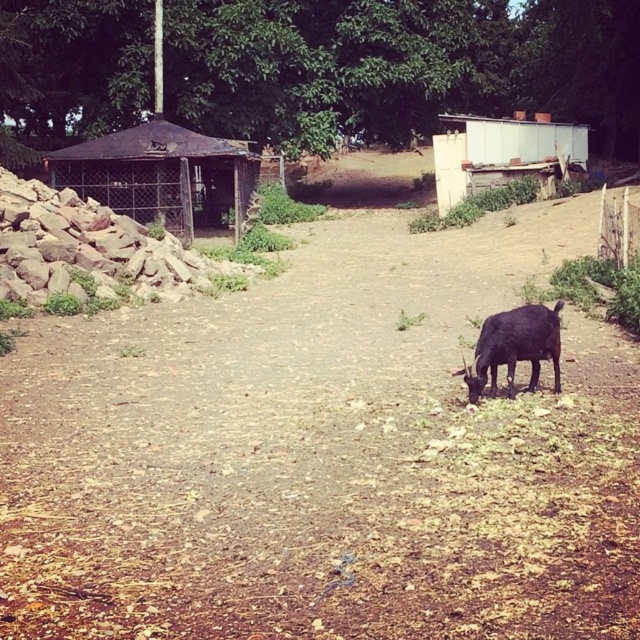
Consider the image. Does brown dirt track at center have a lesser width compared to rusty metal hut at left?

No, brown dirt track at center is not thinner than rusty metal hut at left.

Who is more distant from viewer, (x=307, y=426) or (x=147, y=182)?

Point (x=147, y=182)

The width and height of the screenshot is (640, 640). I want to click on brown dirt track at center, so click(x=324, y=454).

Between point (65, 186) and point (433, 145), which one is positioned behind?

The point (433, 145) is more distant.

Which is more to the right, rusty metal hut at left or white corrugated metal hut at upper right?

Positioned to the right is white corrugated metal hut at upper right.

Who is more forward, (168, 196) or (461, 116)?

Point (168, 196) is in front.

The width and height of the screenshot is (640, 640). In order to click on rusty metal hut at left in this screenshot , I will do `click(161, 176)`.

Does point (499, 140) lie behind point (524, 348)?

That is True.

Is white corrugated metal hut at upper right behind black matte goat at lower right?

Yes, white corrugated metal hut at upper right is behind black matte goat at lower right.

Find the location of `white corrugated metal hut at upper right`. white corrugated metal hut at upper right is located at coordinates (502, 154).